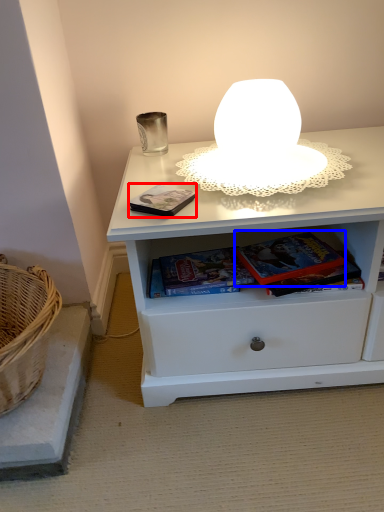
Question: Which object is closer to the camera taking this photo, paperback book (highlighted by a red box) or paperback book (highlighted by a blue box)?

Choices:
 (A) paperback book
 (B) paperback book

Answer: (A)